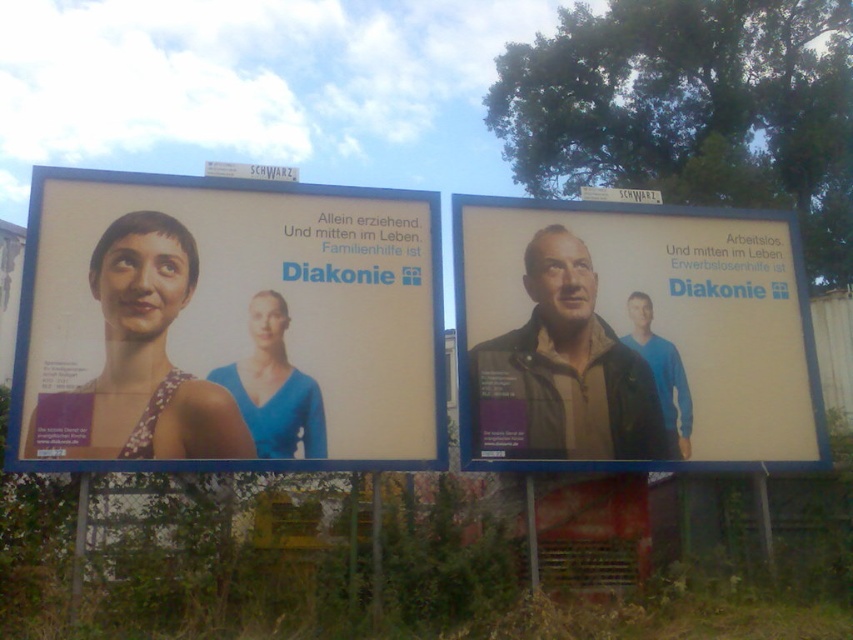
Is matte plastic billboard at center positioned behind matte brown jacket at center?

No, matte plastic billboard at center is in front of matte brown jacket at center.

Does point (329, 259) lie in front of point (521, 396)?

Yes, it is.

You are a GUI agent. You are given a task and a screenshot of the screen. Output one action in this format:
    pyautogui.click(x=<x>, y=<y>)
    Task: Click on the matte plastic billboard at center
    Image resolution: width=853 pixels, height=640 pixels.
    Given the screenshot: What is the action you would take?
    pyautogui.click(x=225, y=324)